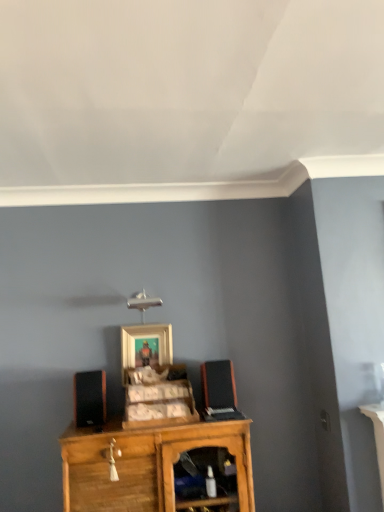
Question: Is the position of wooden cabinet at center less distant than that of wooden cabinet at center?

Choices:
 (A) no
 (B) yes

Answer: (A)

Question: Considering the relative sizes of wooden cabinet at center and wooden cabinet at center in the image provided, is wooden cabinet at center shorter than wooden cabinet at center?

Choices:
 (A) yes
 (B) no

Answer: (A)

Question: From the image's perspective, is wooden cabinet at center located above wooden cabinet at center?

Choices:
 (A) no
 (B) yes

Answer: (B)

Question: Is wooden cabinet at center behind wooden cabinet at center?

Choices:
 (A) yes
 (B) no

Answer: (A)

Question: From the image's perspective, is wooden cabinet at center below wooden cabinet at center?

Choices:
 (A) yes
 (B) no

Answer: (B)

Question: Is wooden picture frame at center in front of or behind black matte speaker at right, marked as the 1th speaker in a right-to-left arrangement, in the image?

Choices:
 (A) front
 (B) behind

Answer: (B)

Question: Considering the positions of wooden picture frame at center and black matte speaker at right, which is the second speaker in left-to-right order, in the image, is wooden picture frame at center taller or shorter than black matte speaker at right, which is the second speaker in left-to-right order,?

Choices:
 (A) tall
 (B) short

Answer: (A)

Question: Is wooden picture frame at center situated inside black matte speaker at right, which is the second speaker in left-to-right order, or outside?

Choices:
 (A) inside
 (B) outside

Answer: (B)

Question: From a real-world perspective, is wooden picture frame at center above or below black matte speaker at right, which is the second speaker in left-to-right order?

Choices:
 (A) below
 (B) above

Answer: (B)

Question: Considering the relative positions of wooden cabinet at center and black matte speaker at right, marked as the 1th speaker in a right-to-left arrangement, in the image provided, is wooden cabinet at center to the left or to the right of black matte speaker at right, marked as the 1th speaker in a right-to-left arrangement,?

Choices:
 (A) right
 (B) left

Answer: (B)

Question: Considering the positions of wooden cabinet at center and black matte speaker at right, which is the second speaker in left-to-right order, in the image, is wooden cabinet at center taller or shorter than black matte speaker at right, which is the second speaker in left-to-right order,?

Choices:
 (A) tall
 (B) short

Answer: (A)

Question: Is wooden cabinet at center in front of or behind black matte speaker at right, marked as the 1th speaker in a right-to-left arrangement, in the image?

Choices:
 (A) front
 (B) behind

Answer: (A)

Question: Is wooden cabinet at center bigger or smaller than black matte speaker at right, marked as the 1th speaker in a right-to-left arrangement?

Choices:
 (A) big
 (B) small

Answer: (A)

Question: Looking at the image, does wooden cabinet at center seem bigger or smaller compared to wooden picture frame at center?

Choices:
 (A) big
 (B) small

Answer: (A)

Question: From the image's perspective, is wooden cabinet at center above or below wooden picture frame at center?

Choices:
 (A) above
 (B) below

Answer: (B)